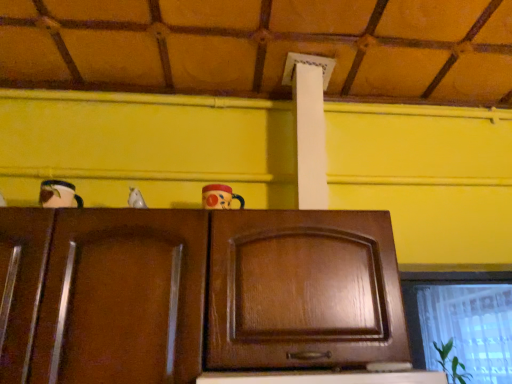
Measure the distance between point (498, 285) and camera.

11.14 feet.

Describe the element at coordinates (461, 321) in the screenshot. I see `transparent plastic window at lower right` at that location.

This screenshot has width=512, height=384. Find the location of `transparent plastic window at lower right`. transparent plastic window at lower right is located at coordinates (461, 321).

In order to click on dark brown wood cabinet at center in this screenshot , I will do `click(303, 291)`.

Consider the image. What is the approximate width of dark brown wood cabinet at center?

dark brown wood cabinet at center is 13.30 inches in width.

The height and width of the screenshot is (384, 512). What do you see at coordinates (303, 291) in the screenshot?
I see `dark brown wood cabinet at center` at bounding box center [303, 291].

What is the approximate height of dark brown wood cabinet at center?

The height of dark brown wood cabinet at center is 15.90 inches.

Identify the location of transparent plastic window at lower right. This screenshot has width=512, height=384. (461, 321).

Is transparent plastic window at lower right to the left of dark brown wood cabinet at center from the viewer's perspective?

In fact, transparent plastic window at lower right is to the right of dark brown wood cabinet at center.

Is transparent plastic window at lower right closer to the viewer compared to dark brown wood cabinet at center?

No, transparent plastic window at lower right is further to the viewer.

Is point (448, 314) positioned in front of point (379, 317)?

No, it is behind (379, 317).

From the image's perspective, is transparent plastic window at lower right above or below dark brown wood cabinet at center?

transparent plastic window at lower right is situated lower than dark brown wood cabinet at center in the image.

Looking at this image, from a real-world perspective, is transparent plastic window at lower right beneath dark brown wood cabinet at center?

Actually, transparent plastic window at lower right is physically above dark brown wood cabinet at center in the real world.

Considering the sizes of transparent plastic window at lower right and dark brown wood cabinet at center in the image, is transparent plastic window at lower right wider or thinner than dark brown wood cabinet at center?

Considering their sizes, transparent plastic window at lower right looks broader than dark brown wood cabinet at center.

Considering the relative sizes of transparent plastic window at lower right and dark brown wood cabinet at center in the image provided, is transparent plastic window at lower right shorter than dark brown wood cabinet at center?

No, transparent plastic window at lower right is not shorter than dark brown wood cabinet at center.

Considering the sizes of transparent plastic window at lower right and dark brown wood cabinet at center in the image, is transparent plastic window at lower right bigger or smaller than dark brown wood cabinet at center?

transparent plastic window at lower right is bigger than dark brown wood cabinet at center.

Is transparent plastic window at lower right completely or partially outside of dark brown wood cabinet at center?

That's correct, transparent plastic window at lower right is outside of dark brown wood cabinet at center.

Is transparent plastic window at lower right far away from dark brown wood cabinet at center?

Yes.

Is transparent plastic window at lower right oriented towards dark brown wood cabinet at center?

No, transparent plastic window at lower right is not facing towards dark brown wood cabinet at center.

What's the angular difference between transparent plastic window at lower right and dark brown wood cabinet at center's facing directions?

They differ by 7.36e-05 degrees in their facing directions.

Identify the location of window behind the dark brown wood cabinet at center. This screenshot has height=384, width=512. (461, 321).

Is dark brown wood cabinet at center to the left of transparent plastic window at lower right from the viewer's perspective?

Yes.

Is dark brown wood cabinet at center behind transparent plastic window at lower right?

No, dark brown wood cabinet at center is in front of transparent plastic window at lower right.

Considering the positions of point (229, 232) and point (506, 367), is point (229, 232) closer or farther from the camera than point (506, 367)?

Point (229, 232).

From the image's perspective, is dark brown wood cabinet at center located above or below transparent plastic window at lower right?

dark brown wood cabinet at center is situated higher than transparent plastic window at lower right in the image.

From a real-world perspective, relative to transparent plastic window at lower right, is dark brown wood cabinet at center vertically above or below?

Clearly, from a real-world perspective, dark brown wood cabinet at center is below transparent plastic window at lower right.

Between dark brown wood cabinet at center and transparent plastic window at lower right, which one has smaller width?

With smaller width is dark brown wood cabinet at center.

From their relative heights in the image, would you say dark brown wood cabinet at center is taller or shorter than transparent plastic window at lower right?

Considering their sizes, dark brown wood cabinet at center has less height than transparent plastic window at lower right.

Can you confirm if dark brown wood cabinet at center is smaller than transparent plastic window at lower right?

Indeed, dark brown wood cabinet at center has a smaller size compared to transparent plastic window at lower right.

Is dark brown wood cabinet at center inside the boundaries of transparent plastic window at lower right, or outside?

dark brown wood cabinet at center lies outside transparent plastic window at lower right.

Looking at this image, is dark brown wood cabinet at center with transparent plastic window at lower right?

They are not placed beside each other.

Is dark brown wood cabinet at center facing towards transparent plastic window at lower right?

No, dark brown wood cabinet at center does not turn towards transparent plastic window at lower right.

How different are the orientations of dark brown wood cabinet at center and transparent plastic window at lower right in degrees?

The facing directions of dark brown wood cabinet at center and transparent plastic window at lower right are 7.36e-05 degrees apart.

The width and height of the screenshot is (512, 384). What are the coordinates of `window behind the dark brown wood cabinet at center` in the screenshot? It's located at (461, 321).

Identify the location of cabinetry above the transparent plastic window at lower right (from the image's perspective). (303, 291).

The width and height of the screenshot is (512, 384). What are the coordinates of `cabinetry on the left of transparent plastic window at lower right` in the screenshot? It's located at (303, 291).